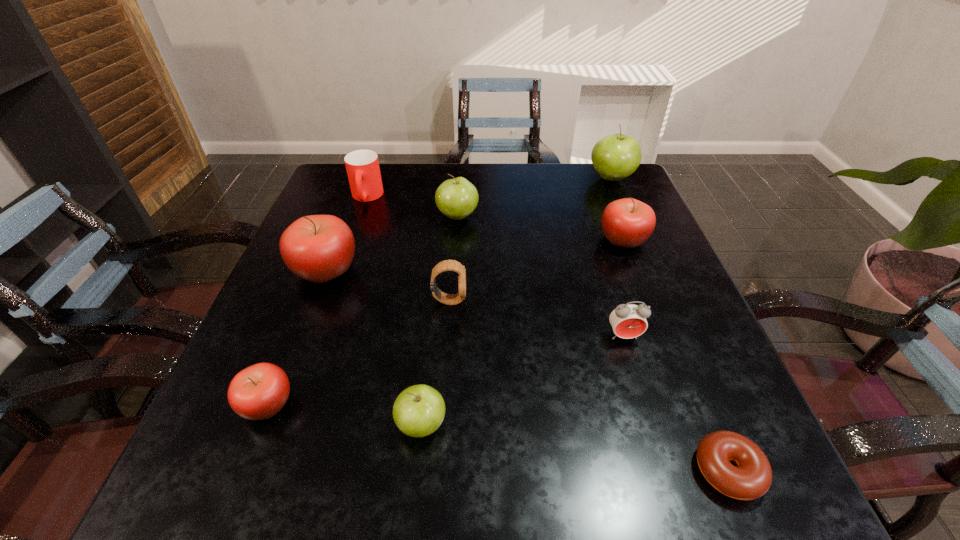
This screenshot has width=960, height=540. I want to click on object situated at the far right corner, so click(614, 157).

The image size is (960, 540). I want to click on object present at the near right corner, so click(x=752, y=478).

Image resolution: width=960 pixels, height=540 pixels. Identify the location of free space at the far edge of the desktop. [444, 178].

The width and height of the screenshot is (960, 540). I want to click on free space at the left edge, so click(366, 215).

Image resolution: width=960 pixels, height=540 pixels. In the image, there is a desktop. Identify the location of vacant region at the right edge. (704, 395).

Locate an element on the screen. This screenshot has width=960, height=540. blank space at the far left corner of the desktop is located at coordinates (333, 166).

In the image, there is a desktop. Identify the location of vacant space at the far right corner. (576, 170).

The image size is (960, 540). I want to click on vacant space that's between the watch and the red cup, so click(x=408, y=249).

The image size is (960, 540). In order to click on free space between the second biggest green apple and the red cup in this screenshot , I will do `click(412, 207)`.

Image resolution: width=960 pixels, height=540 pixels. Identify the location of free area in between the shortest object and the biggest red apple. [527, 370].